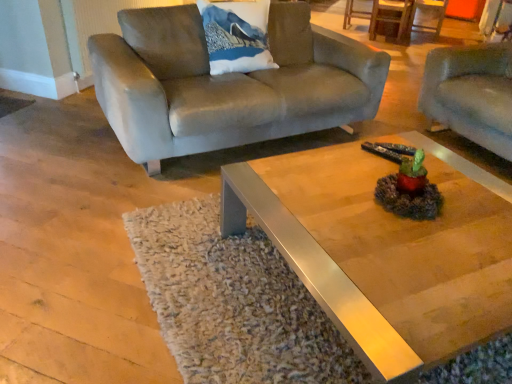
In order to face metallic polished coffee table at center, should I rotate leftwards or rightwards?

Turn right by 5.921 degrees to look at metallic polished coffee table at center.

Image resolution: width=512 pixels, height=384 pixels. I want to click on metallic polished coffee table at center, so click(385, 249).

This screenshot has width=512, height=384. I want to click on suede-like gray couch at right, placed as the 1th studio couch when sorted from right to left, so click(x=471, y=93).

Identify the location of metallic polished coffee table at center. The image size is (512, 384). (385, 249).

Can you confirm if suede-like gray couch at right, which is the 2th studio couch from left to right, is shorter than metallic polished coffee table at center?

In fact, suede-like gray couch at right, which is the 2th studio couch from left to right, may be taller than metallic polished coffee table at center.

Would you say suede-like gray couch at right, placed as the 1th studio couch when sorted from right to left, is outside metallic polished coffee table at center?

suede-like gray couch at right, placed as the 1th studio couch when sorted from right to left, lies outside metallic polished coffee table at center's area.

Is suede-like gray couch at right, placed as the 1th studio couch when sorted from right to left, to the left of metallic polished coffee table at center from the viewer's perspective?

Incorrect, suede-like gray couch at right, placed as the 1th studio couch when sorted from right to left, is not on the left side of metallic polished coffee table at center.

Consider the image. From the image's perspective, is suede-like gray couch at right, which is the 2th studio couch from left to right, above metallic polished coffee table at center?

Correct, suede-like gray couch at right, which is the 2th studio couch from left to right, appears higher than metallic polished coffee table at center in the image.

How different are the orientations of white fabric pillow with mountain print at upper center and metallic polished coffee table at center in degrees?

93 degrees separate the facing orientations of white fabric pillow with mountain print at upper center and metallic polished coffee table at center.

Is point (234, 6) less distant than point (355, 183)?

No, it is behind (355, 183).

I want to click on pillow above the metallic polished coffee table at center (from a real-world perspective), so click(x=237, y=36).

Looking at the image, does suede-like gray couch at right, placed as the 1th studio couch when sorted from right to left, seem bigger or smaller compared to suede couch at upper left, which ranks as the first studio couch in left-to-right order?

Clearly, suede-like gray couch at right, placed as the 1th studio couch when sorted from right to left, is smaller in size than suede couch at upper left, which ranks as the first studio couch in left-to-right order.

From the image's perspective, is suede-like gray couch at right, placed as the 1th studio couch when sorted from right to left, located above suede couch at upper left, placed as the second studio couch when sorted from right to left?

Incorrect, from the image's perspective, suede-like gray couch at right, placed as the 1th studio couch when sorted from right to left, is lower than suede couch at upper left, placed as the second studio couch when sorted from right to left.

In the scene shown: Which object is more forward, suede-like gray couch at right, placed as the 1th studio couch when sorted from right to left, or suede couch at upper left, which ranks as the first studio couch in left-to-right order?

suede couch at upper left, which ranks as the first studio couch in left-to-right order, is closer to the camera.

How far apart are suede-like gray couch at right, placed as the 1th studio couch when sorted from right to left, and suede couch at upper left, placed as the second studio couch when sorted from right to left?

suede-like gray couch at right, placed as the 1th studio couch when sorted from right to left, and suede couch at upper left, placed as the second studio couch when sorted from right to left, are 1.09 meters apart from each other.

From the picture: From a real-world perspective, is suede-like gray couch at right, which is the 2th studio couch from left to right, physically located above or below white fabric pillow with mountain print at upper center?

Clearly, from a real-world perspective, suede-like gray couch at right, which is the 2th studio couch from left to right, is below white fabric pillow with mountain print at upper center.

Which of these two, suede-like gray couch at right, which is the 2th studio couch from left to right, or white fabric pillow with mountain print at upper center, is smaller?

Smaller between the two is white fabric pillow with mountain print at upper center.

There is a suede-like gray couch at right, which is the 2th studio couch from left to right. Where is `pillow above it (from a real-world perspective)`? This screenshot has width=512, height=384. pillow above it (from a real-world perspective) is located at coordinates (237, 36).

Does suede-like gray couch at right, placed as the 1th studio couch when sorted from right to left, turn towards white fabric pillow with mountain print at upper center?

Yes, suede-like gray couch at right, placed as the 1th studio couch when sorted from right to left, is turned towards white fabric pillow with mountain print at upper center.

Can you tell me how much white fabric pillow with mountain print at upper center and suede-like gray couch at right, placed as the 1th studio couch when sorted from right to left, differ in facing direction?

The angle between the facing direction of white fabric pillow with mountain print at upper center and the facing direction of suede-like gray couch at right, placed as the 1th studio couch when sorted from right to left, is 94.1 degrees.

Which is more to the left, white fabric pillow with mountain print at upper center or suede-like gray couch at right, placed as the 1th studio couch when sorted from right to left?

Positioned to the left is white fabric pillow with mountain print at upper center.

Locate an element on the screen. pillow above the suede-like gray couch at right, which is the 2th studio couch from left to right (from the image's perspective) is located at coordinates (237, 36).

Is there a large distance between white fabric pillow with mountain print at upper center and suede-like gray couch at right, which is the 2th studio couch from left to right?

Yes.

Which point is more forward, (447, 186) or (206, 33)?

Positioned in front is point (447, 186).

Based on their positions, is metallic polished coffee table at center located to the left or right of white fabric pillow with mountain print at upper center?

metallic polished coffee table at center is to the right of white fabric pillow with mountain print at upper center.

Is white fabric pillow with mountain print at upper center at the back of metallic polished coffee table at center?

No, metallic polished coffee table at center is not facing the opposite direction of white fabric pillow with mountain print at upper center.

Considering the sizes of metallic polished coffee table at center and white fabric pillow with mountain print at upper center in the image, is metallic polished coffee table at center taller or shorter than white fabric pillow with mountain print at upper center?

Considering their sizes, metallic polished coffee table at center has less height than white fabric pillow with mountain print at upper center.

Considering the sizes of objects suede couch at upper left, placed as the second studio couch when sorted from right to left, and suede-like gray couch at right, which is the 2th studio couch from left to right, in the image provided, who is smaller, suede couch at upper left, placed as the second studio couch when sorted from right to left, or suede-like gray couch at right, which is the 2th studio couch from left to right,?

With smaller size is suede-like gray couch at right, which is the 2th studio couch from left to right.

Is suede couch at upper left, which ranks as the first studio couch in left-to-right order, not close to suede-like gray couch at right, placed as the 1th studio couch when sorted from right to left?

suede couch at upper left, which ranks as the first studio couch in left-to-right order, is far away from suede-like gray couch at right, placed as the 1th studio couch when sorted from right to left.

From the picture: From the image's perspective, relative to suede-like gray couch at right, placed as the 1th studio couch when sorted from right to left, is suede couch at upper left, which ranks as the first studio couch in left-to-right order, above or below?

suede couch at upper left, which ranks as the first studio couch in left-to-right order, is situated higher than suede-like gray couch at right, placed as the 1th studio couch when sorted from right to left, in the image.

In the scene shown: Who is more distant, suede couch at upper left, placed as the second studio couch when sorted from right to left, or suede-like gray couch at right, which is the 2th studio couch from left to right?

Result: suede-like gray couch at right, which is the 2th studio couch from left to right, is further from the camera.

This screenshot has height=384, width=512. Identify the location of coffee table on the left of suede-like gray couch at right, placed as the 1th studio couch when sorted from right to left. (385, 249).

Image resolution: width=512 pixels, height=384 pixels. I want to click on pillow behind the metallic polished coffee table at center, so click(237, 36).

Looking at the image, which one is located further to suede couch at upper left, placed as the second studio couch when sorted from right to left, suede-like gray couch at right, which is the 2th studio couch from left to right, or metallic polished coffee table at center?

suede-like gray couch at right, which is the 2th studio couch from left to right, is further to suede couch at upper left, placed as the second studio couch when sorted from right to left.

When comparing their distances from suede couch at upper left, which ranks as the first studio couch in left-to-right order, does white fabric pillow with mountain print at upper center or metallic polished coffee table at center seem closer?

The object closer to suede couch at upper left, which ranks as the first studio couch in left-to-right order, is white fabric pillow with mountain print at upper center.

Considering their positions, is metallic polished coffee table at center positioned further to suede couch at upper left, placed as the second studio couch when sorted from right to left, than suede-like gray couch at right, which is the 2th studio couch from left to right?

suede-like gray couch at right, which is the 2th studio couch from left to right, is positioned further to the anchor suede couch at upper left, placed as the second studio couch when sorted from right to left.

Looking at the image, which one is located closer to suede-like gray couch at right, placed as the 1th studio couch when sorted from right to left, white fabric pillow with mountain print at upper center or metallic polished coffee table at center?

white fabric pillow with mountain print at upper center lies closer to suede-like gray couch at right, placed as the 1th studio couch when sorted from right to left, than the other object.

Looking at the image, which one is located further to white fabric pillow with mountain print at upper center, suede couch at upper left, placed as the second studio couch when sorted from right to left, or suede-like gray couch at right, placed as the 1th studio couch when sorted from right to left?

suede-like gray couch at right, placed as the 1th studio couch when sorted from right to left, is further to white fabric pillow with mountain print at upper center.

Based on their spatial positions, is suede-like gray couch at right, placed as the 1th studio couch when sorted from right to left, or white fabric pillow with mountain print at upper center further from suede couch at upper left, placed as the second studio couch when sorted from right to left?

suede-like gray couch at right, placed as the 1th studio couch when sorted from right to left, is positioned further to the anchor suede couch at upper left, placed as the second studio couch when sorted from right to left.

From the image, which object appears to be nearer to white fabric pillow with mountain print at upper center, suede-like gray couch at right, which is the 2th studio couch from left to right, or metallic polished coffee table at center?

suede-like gray couch at right, which is the 2th studio couch from left to right, is positioned closer to the anchor white fabric pillow with mountain print at upper center.

Considering their positions, is suede-like gray couch at right, which is the 2th studio couch from left to right, positioned closer to metallic polished coffee table at center than suede couch at upper left, placed as the second studio couch when sorted from right to left?

suede couch at upper left, placed as the second studio couch when sorted from right to left, is closer to metallic polished coffee table at center.

Find the location of a particular element. coffee table between white fabric pillow with mountain print at upper center and suede-like gray couch at right, which is the 2th studio couch from left to right, in the horizontal direction is located at coordinates (385, 249).

Locate an element on the screen. Image resolution: width=512 pixels, height=384 pixels. coffee table between suede couch at upper left, which ranks as the first studio couch in left-to-right order, and suede-like gray couch at right, placed as the 1th studio couch when sorted from right to left, in the horizontal direction is located at coordinates (385, 249).

Image resolution: width=512 pixels, height=384 pixels. In order to click on studio couch between white fabric pillow with mountain print at upper center and suede-like gray couch at right, placed as the 1th studio couch when sorted from right to left, from left to right in this screenshot , I will do `click(227, 84)`.